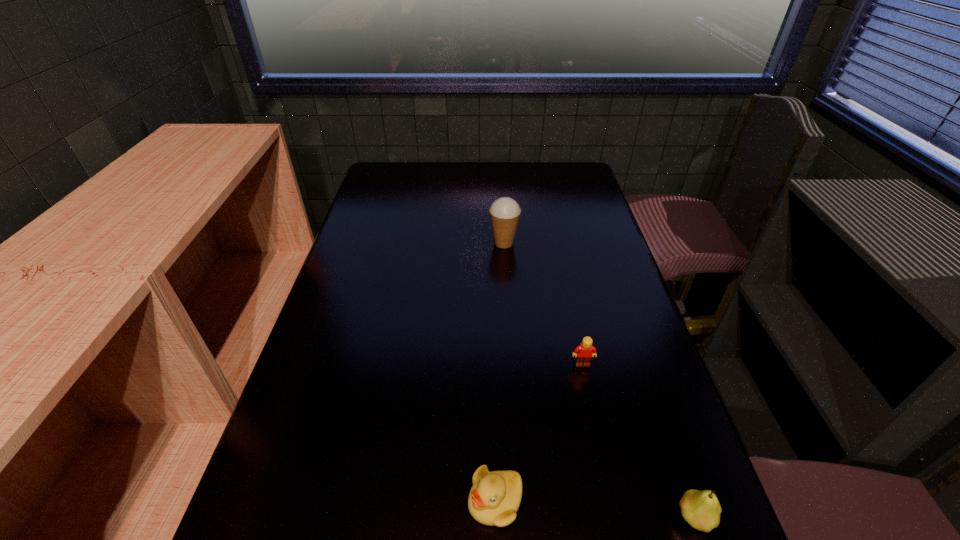
Find the location of `vacant area that lies between the duckling and the Lego`. vacant area that lies between the duckling and the Lego is located at coordinates pyautogui.click(x=539, y=433).

I want to click on unoccupied position between the duckling and the third object from left to right, so click(x=539, y=433).

Where is `free space between the tallest object and the duckling`? Image resolution: width=960 pixels, height=540 pixels. free space between the tallest object and the duckling is located at coordinates (499, 372).

I want to click on free spot between the tallest object and the pear, so click(x=599, y=380).

Where is `free space between the rightmost object and the tallest object`? The width and height of the screenshot is (960, 540). free space between the rightmost object and the tallest object is located at coordinates (599, 380).

This screenshot has height=540, width=960. Identify the location of unoccupied area between the icecream and the rightmost object. (599, 380).

This screenshot has height=540, width=960. Identify the location of free spot between the pear and the third object from left to right. (638, 441).

Locate an element on the screen. Image resolution: width=960 pixels, height=540 pixels. the third closest object to the duckling is located at coordinates click(505, 212).

The height and width of the screenshot is (540, 960). What are the coordinates of `object that is the second closest one to the Lego` in the screenshot? It's located at (701, 509).

Locate an element on the screen. Image resolution: width=960 pixels, height=540 pixels. vacant region that satisfies the following two spatial constraints: 1. on the face of the third nearest object; 2. on the beak of the duckling is located at coordinates (612, 501).